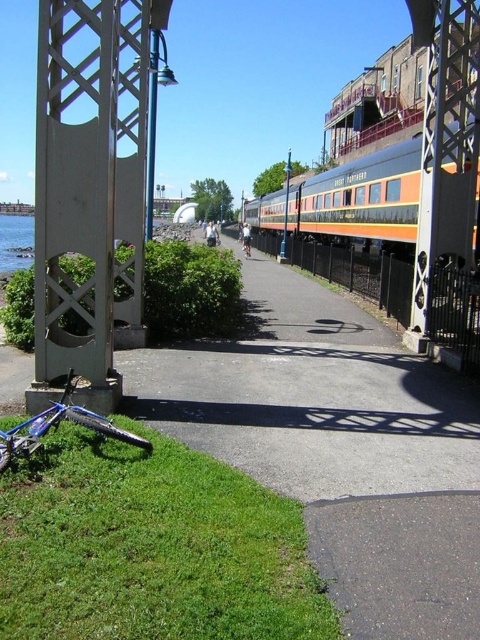
Between green grass at lower left and blue metallic bicycle at lower left, which one is positioned higher?

blue metallic bicycle at lower left is higher up.

Who is taller, green grass at lower left or blue metallic bicycle at lower left?

blue metallic bicycle at lower left

Is point (12, 572) less distant than point (46, 410)?

Yes, it is.

You are a GUI agent. You are given a task and a screenshot of the screen. Output one action in this format:
    pyautogui.click(x=<x>, y=<y>)
    Task: Click on the green grass at lower left
    This screenshot has height=640, width=480.
    Given the screenshot: What is the action you would take?
    pyautogui.click(x=151, y=547)

Is green grass at lower left shorter than orange polished wood passenger train at center?

Indeed, green grass at lower left has a lesser height compared to orange polished wood passenger train at center.

Can you confirm if green grass at lower left is positioned below orange polished wood passenger train at center?

Correct, green grass at lower left is located below orange polished wood passenger train at center.

Which is behind, point (17, 492) or point (391, 214)?

Positioned behind is point (391, 214).

Where is `green grass at lower left`? green grass at lower left is located at coordinates [151, 547].

Does orange polished wood passenger train at center have a greater width compared to clear water at lower left?

In fact, orange polished wood passenger train at center might be narrower than clear water at lower left.

Is orange polished wood passenger train at center to the right of clear water at lower left from the viewer's perspective?

Indeed, orange polished wood passenger train at center is positioned on the right side of clear water at lower left.

Which is in front, point (415, 163) or point (29, 218)?

Positioned in front is point (415, 163).

The image size is (480, 640). What are the coordinates of `orange polished wood passenger train at center` in the screenshot? It's located at (362, 200).